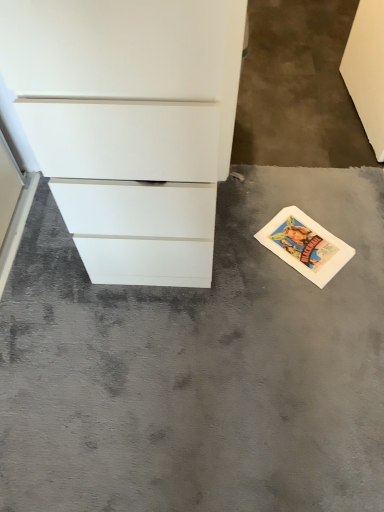
Locate an element on the screen. The image size is (384, 512). vacant space underneath white paper postcard at lower right (from a real-world perspective) is located at coordinates (308, 241).